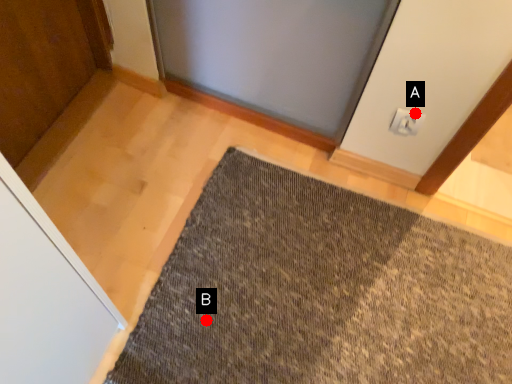
Question: Two points are circled on the image, labeled by A and B beside each circle. Which of the following is the farthest from the observer?

Choices:
 (A) A is further
 (B) B is further

Answer: (A)